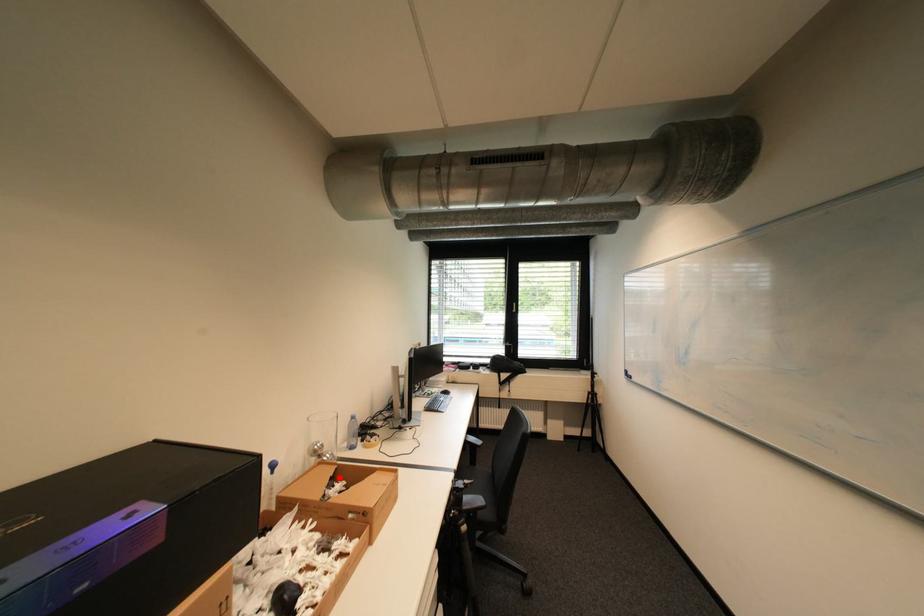
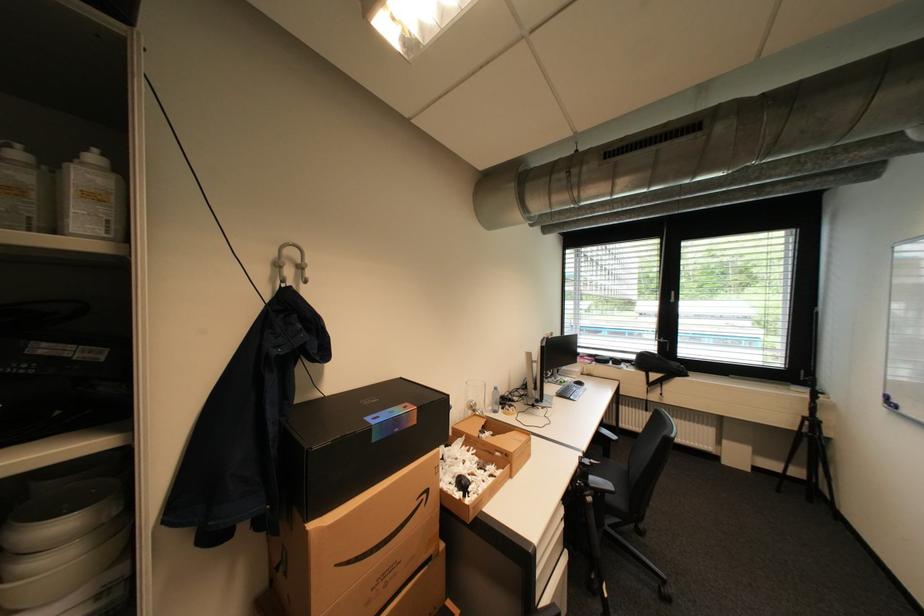
The point at the highlighted location is marked in the first image. Where is the corresponding point in the second image?

(492, 426)